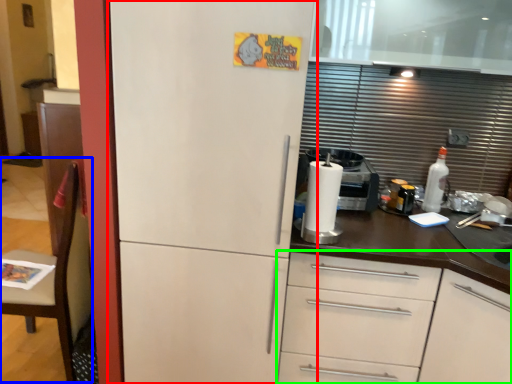
Question: Estimate the real-world distances between objects in this image. Which object is closer to refrigerator (highlighted by a red box), chair (highlighted by a blue box) or cabinetry (highlighted by a green box)?

Choices:
 (A) chair
 (B) cabinetry

Answer: (B)